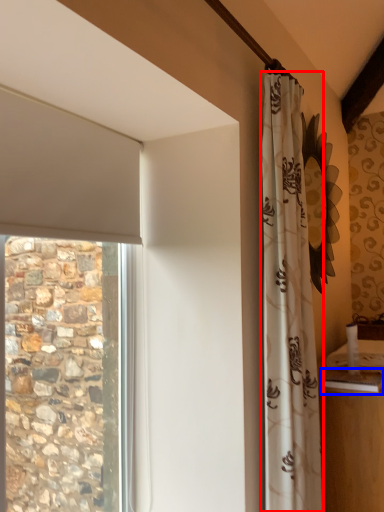
Question: Among these objects, which one is nearest to the camera, curtain (highlighted by a red box) or counter top (highlighted by a blue box)?

Choices:
 (A) curtain
 (B) counter top

Answer: (A)